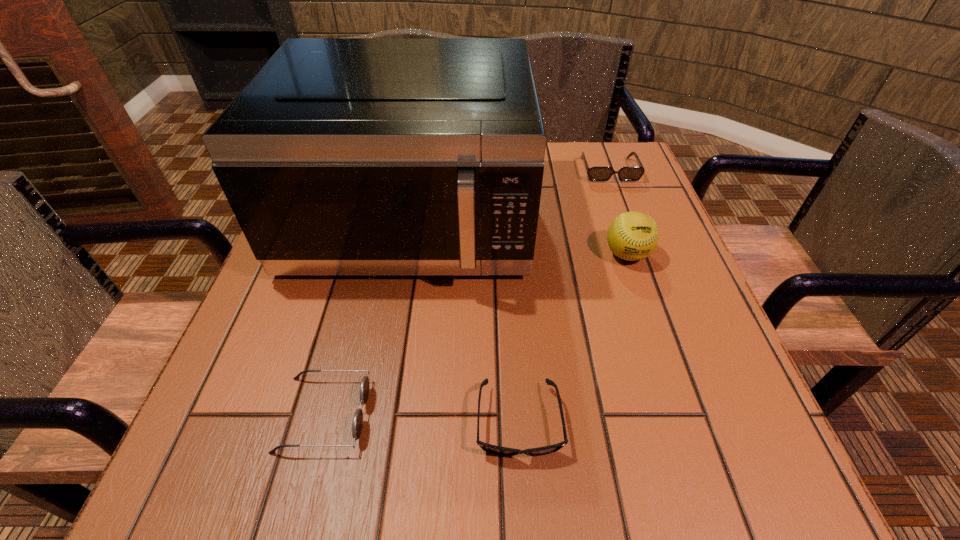
The width and height of the screenshot is (960, 540). Identify the location of sunglasses present at the far edge. (594, 173).

Identify the location of microwave_oven that is at the left edge. (342, 156).

At what (x,y) coordinates should I click in order to perform the action: click on sunglasses at the left edge. Please return your answer as a coordinate pair (x, y). This screenshot has width=960, height=540. Looking at the image, I should click on (357, 425).

At what (x,y) coordinates should I click in order to perform the action: click on softball present at the right edge. Please return your answer as a coordinate pair (x, y). Image resolution: width=960 pixels, height=540 pixels. Looking at the image, I should click on (632, 236).

You are a GUI agent. You are given a task and a screenshot of the screen. Output one action in this format:
    pyautogui.click(x=<x>, y=<y>)
    Task: Click on the sunglasses present at the right edge
    
    Given the screenshot: What is the action you would take?
    pyautogui.click(x=594, y=173)

Locate an element on the screen. The height and width of the screenshot is (540, 960). object present at the far left corner is located at coordinates (342, 156).

Locate an element on the screen. object present at the near left corner is located at coordinates (357, 425).

Identify the location of object present at the far right corner. (594, 173).

In the image, there is a desktop. Identify the location of vacant space at the left edge. (262, 350).

Where is `vacant point at the right edge`? vacant point at the right edge is located at coordinates (632, 201).